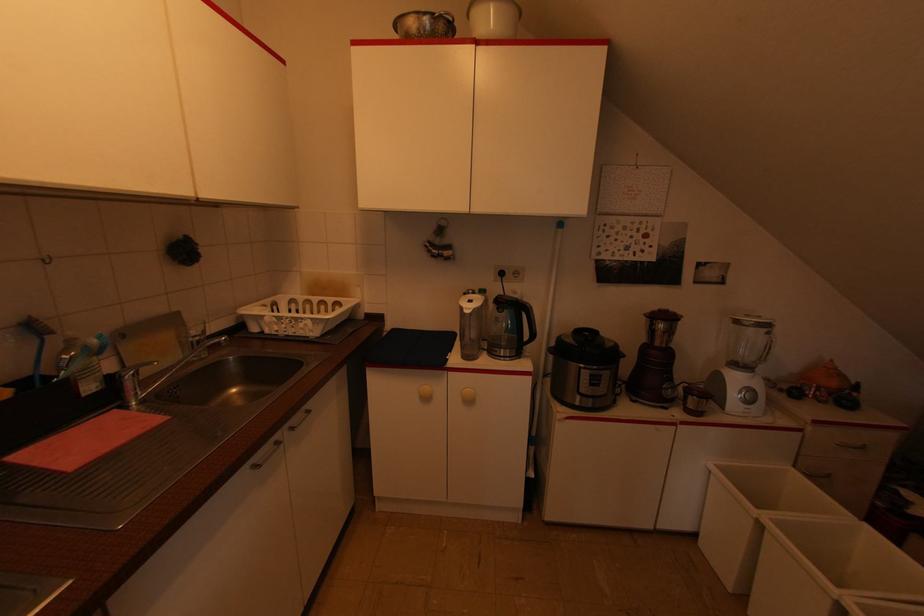
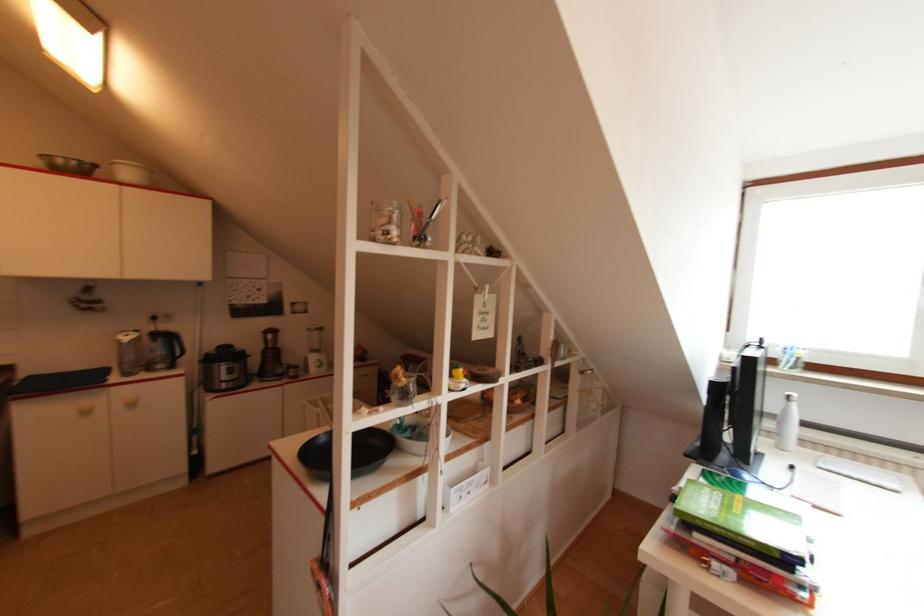
Find the pixel in the second image that matches (533,337) in the first image.

(184, 352)